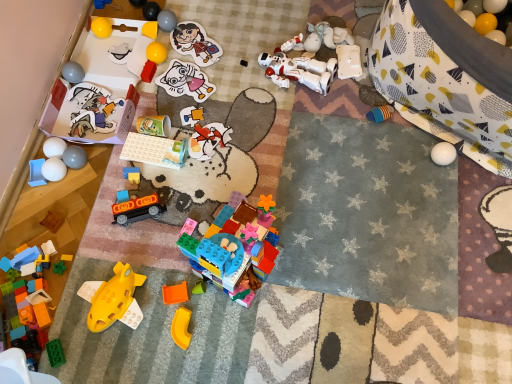
I want to click on empty space that is in between yellow rubber ball at upper left, positioned as the 11th toy in right-to-left order, and matte blue plastic toy at center, marked as the thirteenth toy in a right-to-left arrangement, so tap(145, 120).